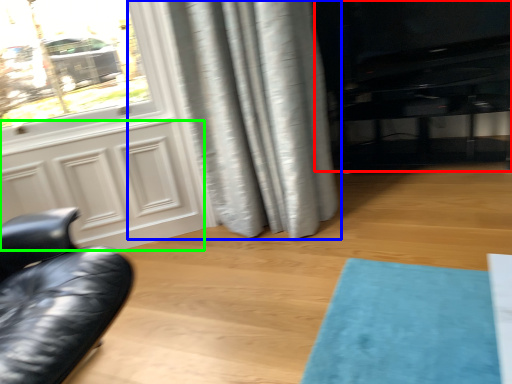
Question: Which object is positioned closest to entertainment center (highlighted by a red box)? Select from curtain (highlighted by a blue box) and screen door (highlighted by a green box).

Choices:
 (A) curtain
 (B) screen door

Answer: (A)